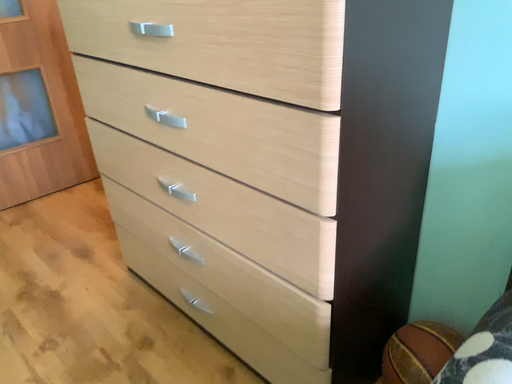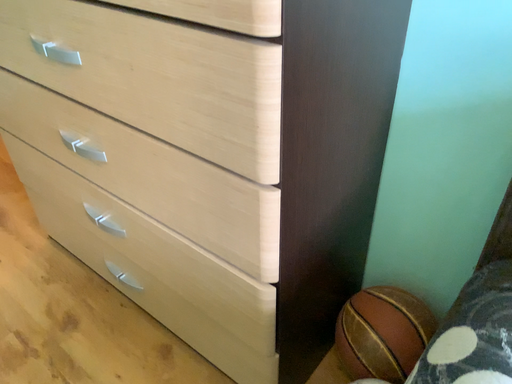
Question: Which way did the camera rotate in the video?

Choices:
 (A) rotated upward
 (B) rotated downward

Answer: (B)